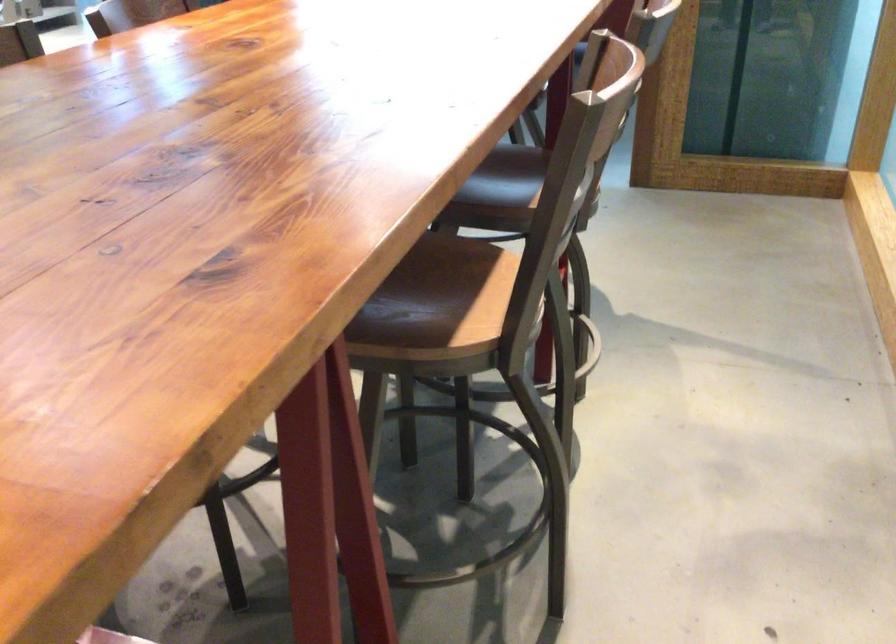
The first image is from the beginning of the video and the second image is from the end. How did the camera likely rotate when shooting the video?

The camera's rotation is toward left-down.